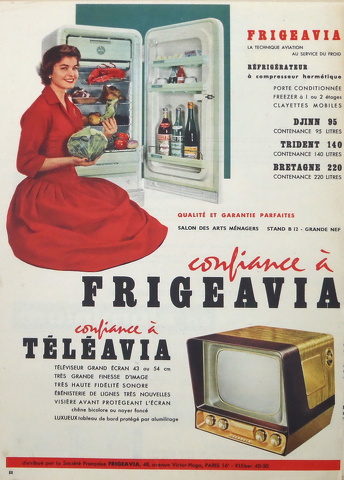
I want to click on metallic knobs, so click(211, 420), click(226, 423), click(263, 437), click(274, 440).